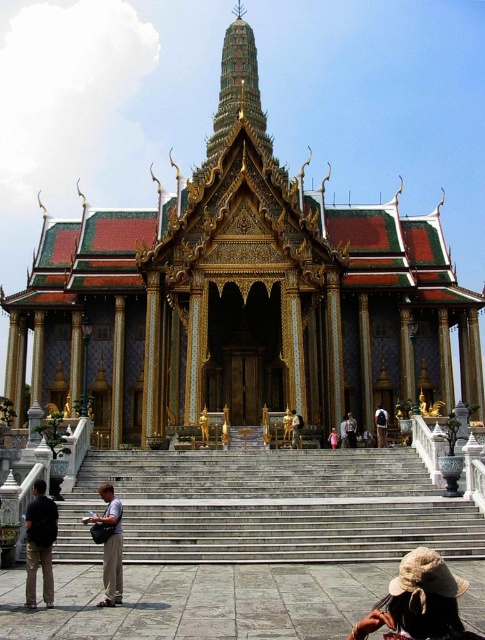
You are a tourist standing at the entrance of the temple. You want to place your brown woven hat at lower right on the white marble stairs at center. Is the hat currently positioned to the right or left of the stairs?

The brown woven hat at lower right is positioned to the right of the white marble stairs at center, so you would need to move it to the left to place it on the stairs.

You are a tourist visiting the temple and want to take a photo of both the brown woven hat at lower right and the black cotton shirt at lower left. Which object should you focus on first to ensure both are in the frame?

You should focus on the black cotton shirt at lower left first because the brown woven hat at lower right is located below it, so adjusting the camera angle to include the lower area will capture both.